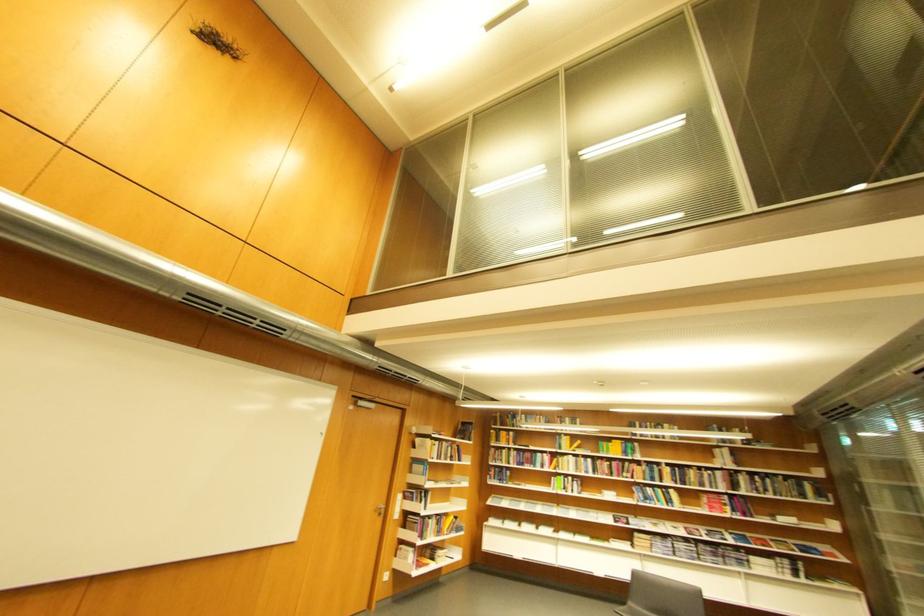
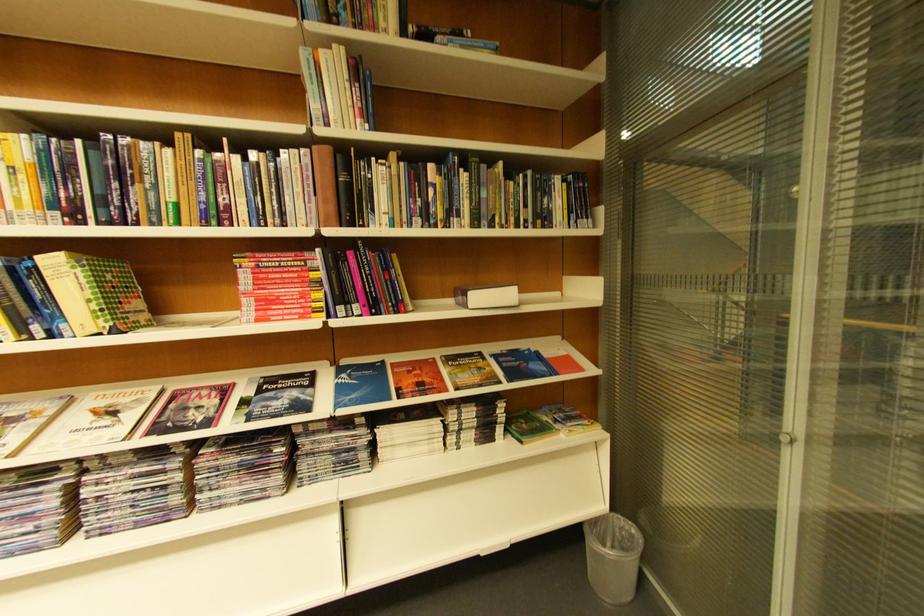
The point at (682,493) is marked in the first image. Where is the corresponding point in the second image?

(63, 264)